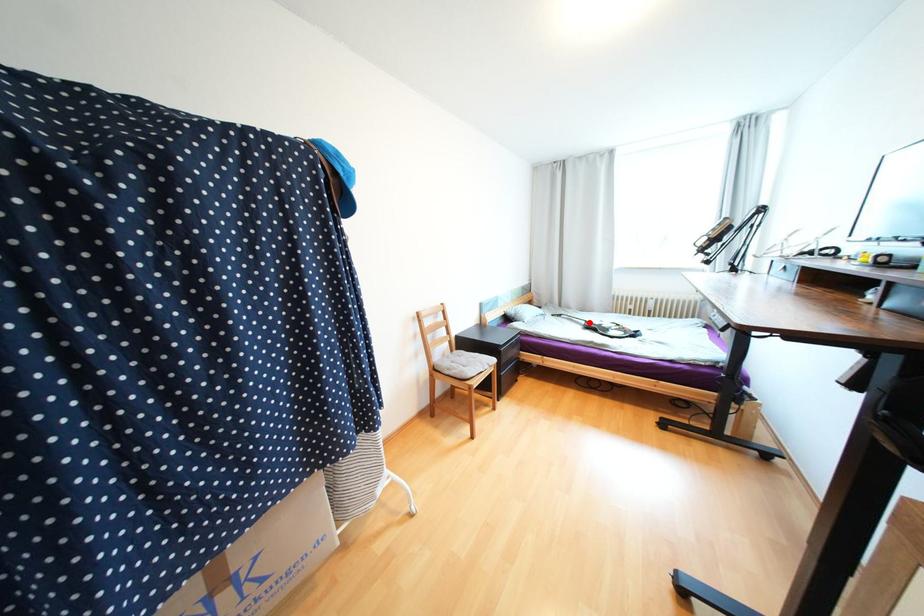
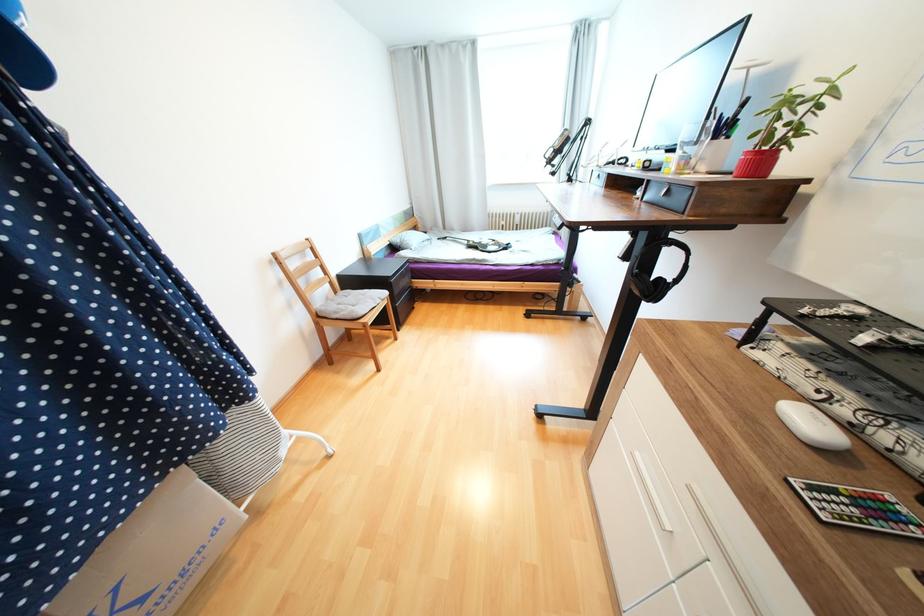
In the second image, find the point that corresponds to the highlighted location in the first image.

(471, 243)